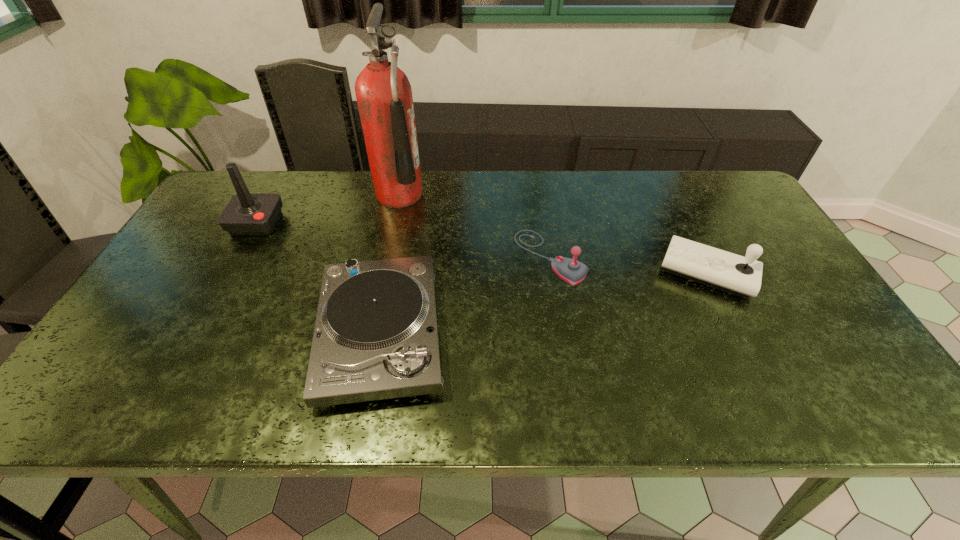
At what (x,y) coordinates should I click in order to perform the action: click on the tallest object. Please return your answer as a coordinate pair (x, y). Image resolution: width=960 pixels, height=540 pixels. Looking at the image, I should click on (384, 96).

In order to click on the tallest joystick in this screenshot , I will do (247, 214).

What are the coordinates of `the leftmost joystick` in the screenshot? It's located at (247, 214).

Locate an element on the screen. Image resolution: width=960 pixels, height=540 pixels. the second tallest joystick is located at coordinates (729, 272).

Locate an element on the screen. the rightmost joystick is located at coordinates [x=729, y=272].

This screenshot has height=540, width=960. Identify the location of the fourth object from left to right. click(x=572, y=271).

You are a GUI agent. You are given a task and a screenshot of the screen. Output one action in this format:
    pyautogui.click(x=<x>, y=<y>)
    Task: Click on the second joystick from right to left
    The image size is (960, 540).
    Given the screenshot: What is the action you would take?
    pyautogui.click(x=572, y=271)

The image size is (960, 540). Identify the location of record player. (376, 337).

Find the location of a particular element. free space located 0.220m on the front of the tallest object near the operation label is located at coordinates (492, 195).

Find the location of `blank area located 0.200m on the back of the leftmost joystick`. blank area located 0.200m on the back of the leftmost joystick is located at coordinates coord(285,173).